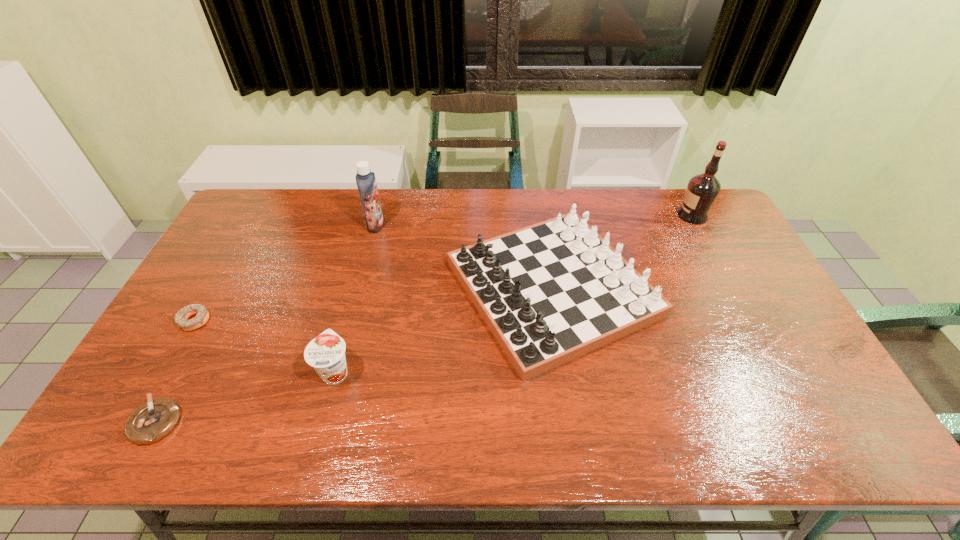
Find the location of a particular element. free space between the liquor and the doughnut is located at coordinates (444, 268).

Where is `vacant area that lies between the nearest object and the doughnut`? The image size is (960, 540). vacant area that lies between the nearest object and the doughnut is located at coordinates (175, 371).

The width and height of the screenshot is (960, 540). In order to click on unoccupied position between the rightmost object and the shampoo in this screenshot , I will do `click(534, 220)`.

Find the location of a particular element. The image size is (960, 540). free space between the doughnut and the ashtray is located at coordinates (175, 371).

Where is `vacant area that lies between the ashtray and the gameboard`? This screenshot has height=540, width=960. vacant area that lies between the ashtray and the gameboard is located at coordinates (354, 355).

Image resolution: width=960 pixels, height=540 pixels. What are the coordinates of `free space between the nearest object and the tallest object` in the screenshot? It's located at (424, 319).

In order to click on free spot between the yogurt and the fifth shortest object in this screenshot , I will do `click(355, 298)`.

The height and width of the screenshot is (540, 960). In order to click on vacant space that's between the fifth shortest object and the fourth tallest object in this screenshot , I will do `click(355, 298)`.

Locate an element on the screen. The height and width of the screenshot is (540, 960). vacant space in between the second object from right to left and the yogurt is located at coordinates (444, 330).

Select which object is the fourth closest to the liquor. Please provide its 2D coordinates. Your answer should be formatted as a tuple, i.e. [(x, y)], where the tuple contains the x and y coordinates of a point satisfying the conditions above.

[(202, 312)]